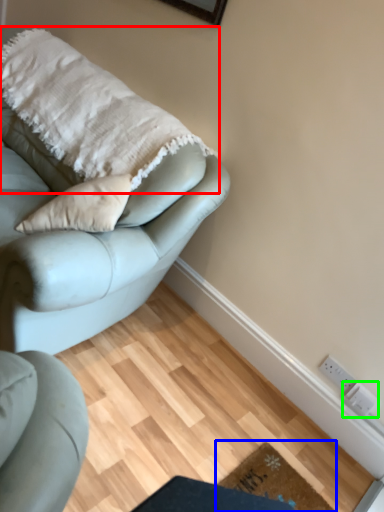
Question: Estimate the real-world distances between objects in this image. Which object is closer to blanket (highlighted by a red box), doormat (highlighted by a blue box) or electric outlet (highlighted by a green box)?

Choices:
 (A) doormat
 (B) electric outlet

Answer: (A)